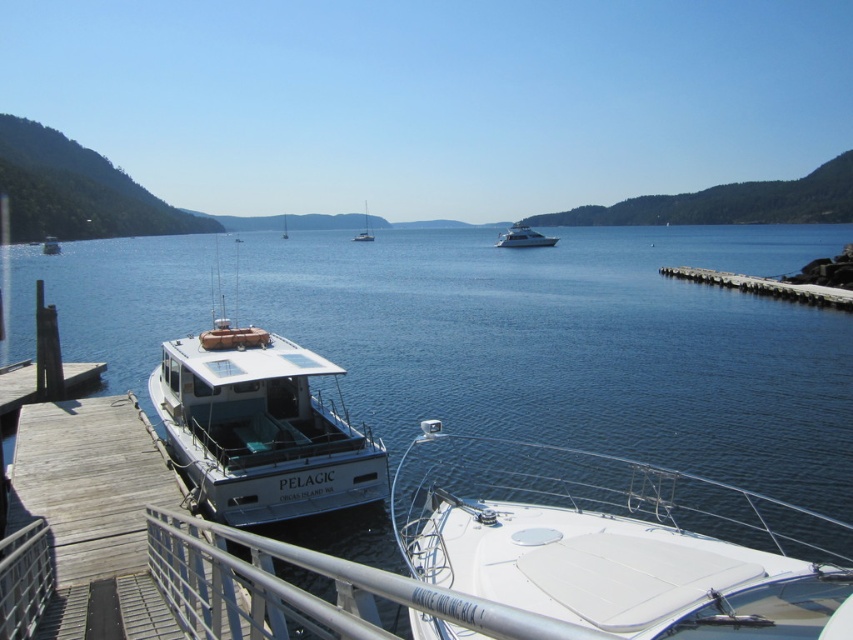
Question: Which of the following is the farthest from the observer?

Choices:
 (A) (666, 458)
 (B) (532, 234)

Answer: (B)

Question: In this image, where is white matte boat at lower left located relative to white glossy yacht at center?

Choices:
 (A) left
 (B) right

Answer: (A)

Question: Which point is farther to the camera?

Choices:
 (A) (338, 502)
 (B) (358, 240)
 (C) (407, 328)
 (D) (512, 244)

Answer: (B)

Question: Where is white matte boat at left located in relation to white matte boat at center in the image?

Choices:
 (A) right
 (B) left

Answer: (B)

Question: Which is nearer to the white matte boat at center?

Choices:
 (A) white matte sailboat at center
 (B) white matte boat at left

Answer: (A)

Question: Does white glossy yacht at center appear on the left side of white matte boat at center?

Choices:
 (A) no
 (B) yes

Answer: (A)